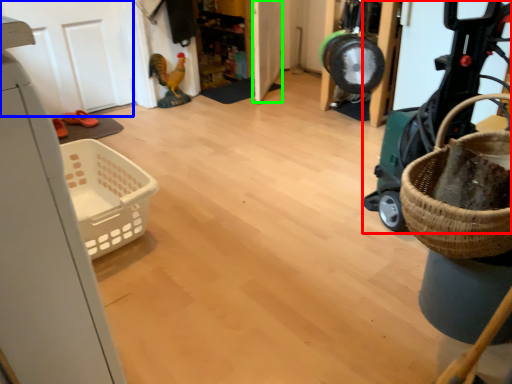
Question: Which is nearer to the baby carriage (highlighted by a red box)? door (highlighted by a blue box) or door (highlighted by a green box).

Choices:
 (A) door
 (B) door

Answer: (B)